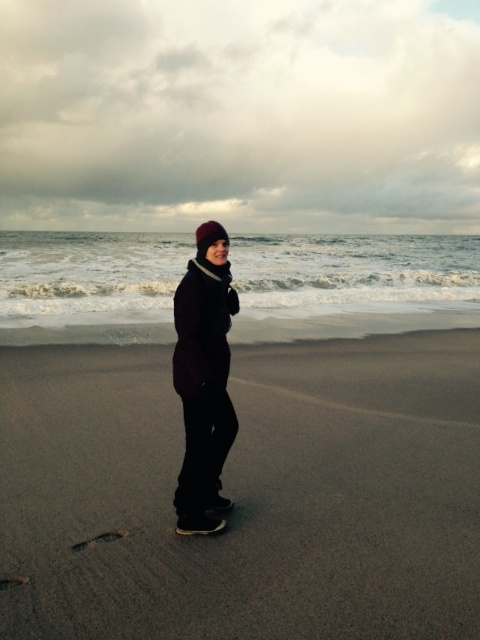
Question: Which of the following is the closest to the observer?

Choices:
 (A) matte dark brown coat at center
 (B) dark sand at center

Answer: (B)

Question: Which object appears farthest from the camera in this image?

Choices:
 (A) dark sand at center
 (B) matte dark brown coat at center

Answer: (B)

Question: Does dark sand at center appear on the right side of matte dark brown coat at center?

Choices:
 (A) yes
 (B) no

Answer: (B)

Question: Is dark sand at center to the right of matte dark brown coat at center from the viewer's perspective?

Choices:
 (A) yes
 (B) no

Answer: (B)

Question: Is dark sand at center bigger than matte dark brown coat at center?

Choices:
 (A) yes
 (B) no

Answer: (A)